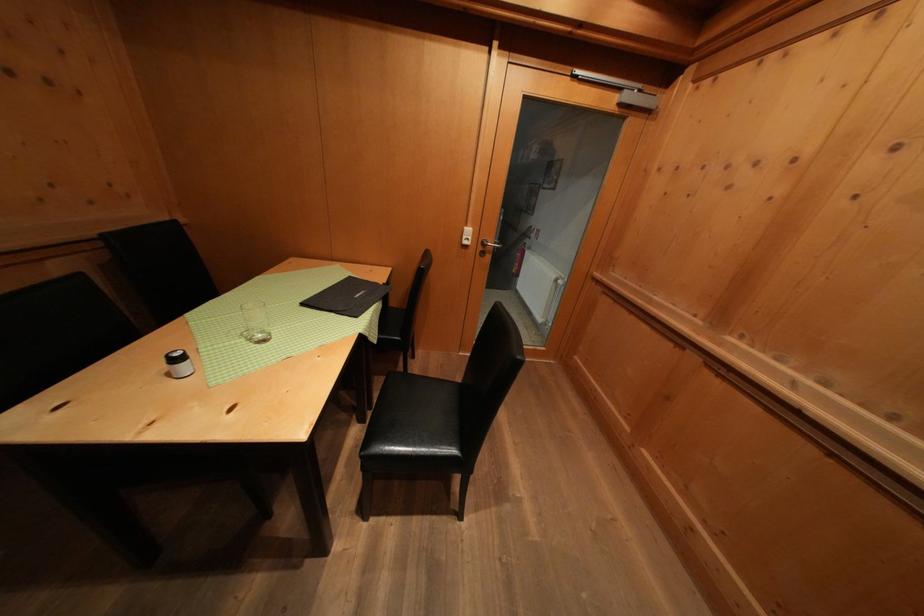
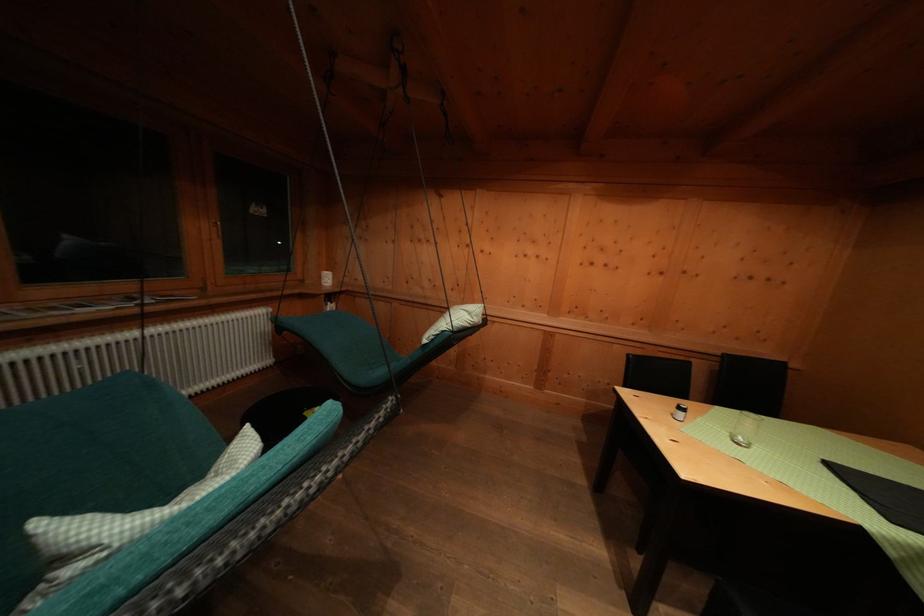
Question: How did the camera likely rotate?

Choices:
 (A) Left
 (B) Right
 (C) Up
 (D) Down

Answer: (A)